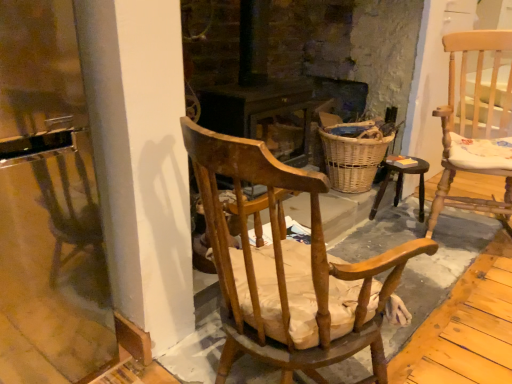
Question: Is wooden chair with cushion at center, the first chair viewed from the left, oriented away from wooden stool at center?

Choices:
 (A) no
 (B) yes

Answer: (A)

Question: Is wooden chair with cushion at center, which is the second chair in right-to-left order, further to camera compared to wooden stool at center?

Choices:
 (A) no
 (B) yes

Answer: (A)

Question: Are wooden chair with cushion at center, the first chair viewed from the left, and wooden stool at center located far from each other?

Choices:
 (A) yes
 (B) no

Answer: (A)

Question: Does wooden chair with cushion at center, the first chair viewed from the left, have a greater width compared to wooden stool at center?

Choices:
 (A) no
 (B) yes

Answer: (B)

Question: Does wooden chair with cushion at center, positioned as the 1th chair in front-to-back order, have a lesser width compared to wooden stool at center?

Choices:
 (A) yes
 (B) no

Answer: (B)

Question: From the image's perspective, is woven wicker basket at center above or below wooden chair with cushion at center, which is the second chair in right-to-left order?

Choices:
 (A) below
 (B) above

Answer: (B)

Question: Is woven wicker basket at center wider or thinner than wooden chair with cushion at center, the first chair viewed from the left?

Choices:
 (A) thin
 (B) wide

Answer: (A)

Question: Considering the positions of point (376, 158) and point (364, 261), is point (376, 158) closer or farther from the camera than point (364, 261)?

Choices:
 (A) closer
 (B) farther

Answer: (B)

Question: From their relative heights in the image, would you say woven wicker basket at center is taller or shorter than wooden chair with cushion at center, the first chair viewed from the left?

Choices:
 (A) short
 (B) tall

Answer: (A)

Question: In terms of height, does light wood cushioned chair at right, the first chair from the back, look taller or shorter compared to woven wicker basket at center?

Choices:
 (A) short
 (B) tall

Answer: (B)

Question: From a real-world perspective, relative to woven wicker basket at center, is light wood cushioned chair at right, the first chair from the back, vertically above or below?

Choices:
 (A) below
 (B) above

Answer: (B)

Question: Does point (493, 71) appear closer or farther from the camera than point (340, 139)?

Choices:
 (A) closer
 (B) farther

Answer: (B)

Question: Considering the relative positions of light wood cushioned chair at right, arranged as the 1th chair when viewed from the right, and woven wicker basket at center in the image provided, is light wood cushioned chair at right, arranged as the 1th chair when viewed from the right, to the left or to the right of woven wicker basket at center?

Choices:
 (A) left
 (B) right

Answer: (B)

Question: From the image's perspective, relative to woven wicker basket at center, is wooden stool at center above or below?

Choices:
 (A) below
 (B) above

Answer: (A)

Question: Looking at their shapes, would you say wooden stool at center is wider or thinner than woven wicker basket at center?

Choices:
 (A) wide
 (B) thin

Answer: (B)